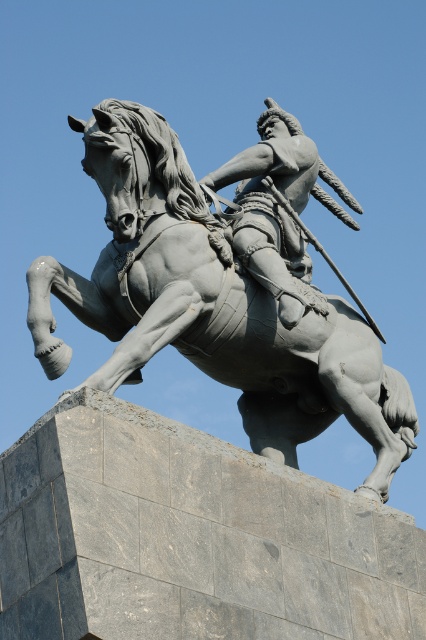
Is gray stone statue at center above polished bronze rider at center?

No, gray stone statue at center is not above polished bronze rider at center.

Consider the image. Does gray stone statue at center have a lesser height compared to polished bronze rider at center?

Incorrect, gray stone statue at center's height does not fall short of polished bronze rider at center's.

Measure the distance between gray stone statue at center and camera.

gray stone statue at center is 60.70 meters away from camera.

Locate an element on the screen. The image size is (426, 640). gray stone statue at center is located at coordinates (212, 307).